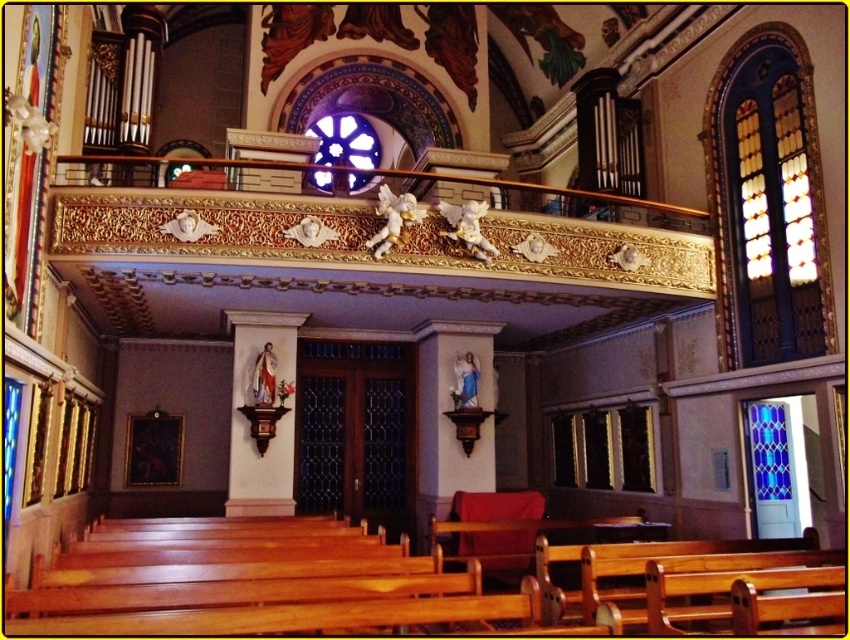
Question: Which point is farther from the camera taking this photo?

Choices:
 (A) (785, 440)
 (B) (765, 51)

Answer: (A)

Question: Considering the real-world distances, which object is farthest from the stained glass at upper right?

Choices:
 (A) stained glass window at upper center
 (B) blue stained glass at right

Answer: (A)

Question: Is stained glass at upper right wider than stained glass window at upper center?

Choices:
 (A) yes
 (B) no

Answer: (B)

Question: Is stained glass at upper right above stained glass window at upper center?

Choices:
 (A) yes
 (B) no

Answer: (B)

Question: Is blue stained glass at right wider than stained glass window at upper center?

Choices:
 (A) no
 (B) yes

Answer: (A)

Question: Which of these objects is positioned farthest from the stained glass at upper right?

Choices:
 (A) blue stained glass at right
 (B) stained glass window at upper center

Answer: (B)